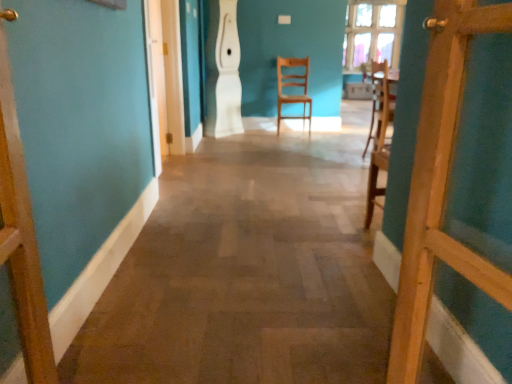
Question: Is wooden floor at center next to clear glass window at upper center?

Choices:
 (A) no
 (B) yes

Answer: (A)

Question: Is wooden floor at center not close to clear glass window at upper center?

Choices:
 (A) no
 (B) yes

Answer: (B)

Question: Considering the relative positions of wooden floor at center and clear glass window at upper center in the image provided, is wooden floor at center behind clear glass window at upper center?

Choices:
 (A) no
 (B) yes

Answer: (A)

Question: Could you tell me if wooden floor at center is turned towards clear glass window at upper center?

Choices:
 (A) no
 (B) yes

Answer: (A)

Question: Is clear glass window at upper center inside wooden floor at center?

Choices:
 (A) no
 (B) yes

Answer: (A)

Question: Considering their positions, is wooden chair at right, the 2th chair viewed from the back, located in front of or behind light wood chair at center, placed as the second chair when sorted from front to back?

Choices:
 (A) behind
 (B) front

Answer: (B)

Question: Considering the relative positions of wooden chair at right, the 2th chair viewed from the back, and light wood chair at center, the 1th chair viewed from the back, in the image provided, is wooden chair at right, the 2th chair viewed from the back, to the left or to the right of light wood chair at center, the 1th chair viewed from the back,?

Choices:
 (A) right
 (B) left

Answer: (A)

Question: From a real-world perspective, is wooden chair at right, the 1th chair positioned from the front, above or below light wood chair at center, placed as the second chair when sorted from front to back?

Choices:
 (A) above
 (B) below

Answer: (B)

Question: Considering the positions of wooden chair at right, the 1th chair positioned from the front, and light wood chair at center, positioned as the 2th chair in right-to-left order, in the image, is wooden chair at right, the 1th chair positioned from the front, bigger or smaller than light wood chair at center, positioned as the 2th chair in right-to-left order,?

Choices:
 (A) small
 (B) big

Answer: (A)

Question: Based on their positions, is wooden floor at center located to the left or right of clear glass window at upper center?

Choices:
 (A) right
 (B) left

Answer: (B)

Question: From the image's perspective, is wooden floor at center above or below clear glass window at upper center?

Choices:
 (A) below
 (B) above

Answer: (A)

Question: Is wooden floor at center bigger or smaller than clear glass window at upper center?

Choices:
 (A) small
 (B) big

Answer: (B)

Question: Is wooden floor at center inside the boundaries of clear glass window at upper center, or outside?

Choices:
 (A) inside
 (B) outside

Answer: (B)

Question: In terms of width, does wooden door at right look wider or thinner when compared to clear glass window at upper center?

Choices:
 (A) wide
 (B) thin

Answer: (B)

Question: Based on their positions, is wooden door at right located to the left or right of clear glass window at upper center?

Choices:
 (A) right
 (B) left

Answer: (B)